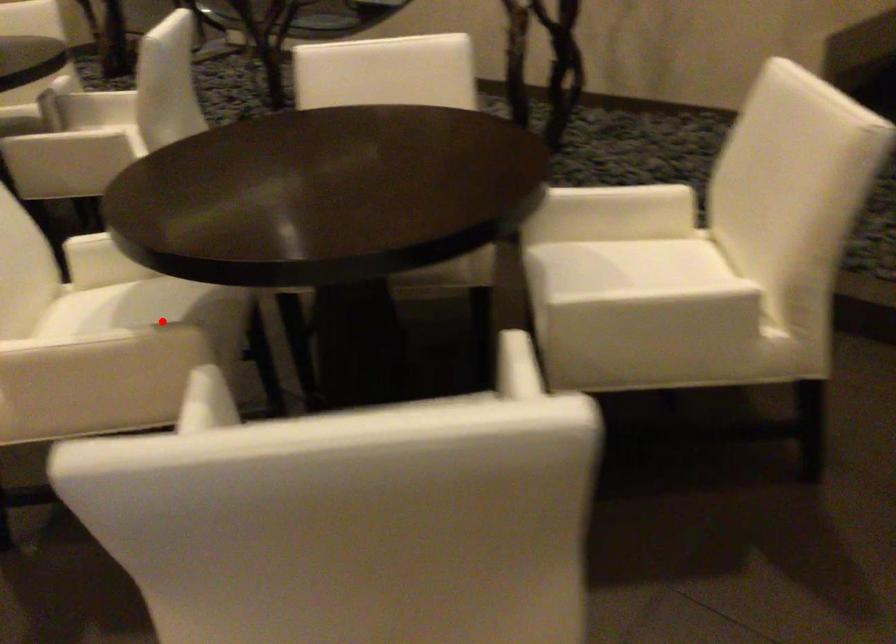
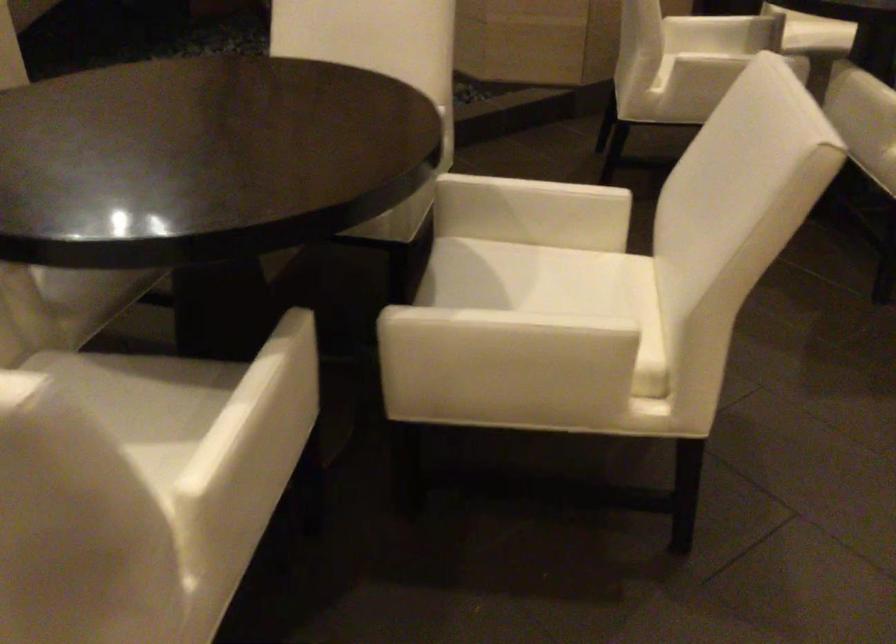
In the second image, find the point that corresponds to the highlighted location in the first image.

(142, 401)